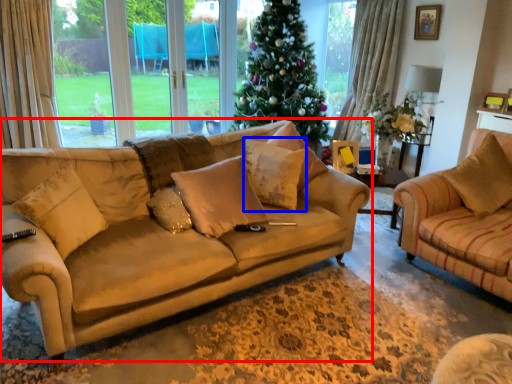
Question: Which point is closer to the camera, studio couch (highlighted by a red box) or pillow (highlighted by a blue box)?

Choices:
 (A) studio couch
 (B) pillow

Answer: (A)